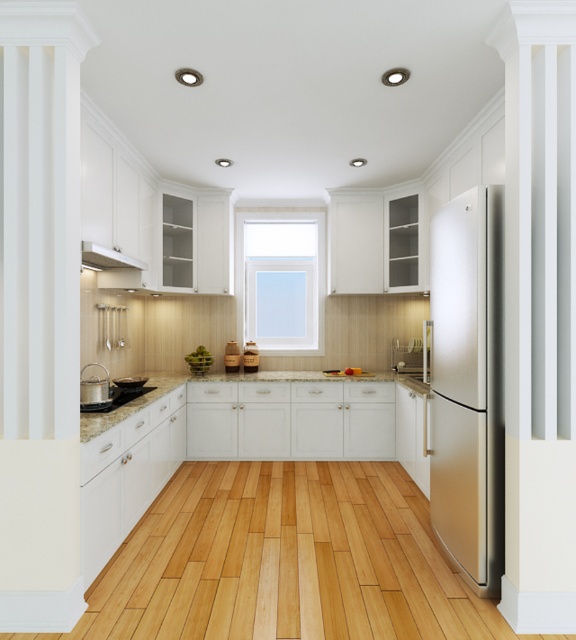
Question: Which object is closer to the camera taking this photo?

Choices:
 (A) satin stainless steel refrigerator at right
 (B) white matte exhaust hood at upper left
 (C) transparent glass window at center

Answer: (A)

Question: Does satin stainless steel refrigerator at right lie in front of transparent glass window at center?

Choices:
 (A) yes
 (B) no

Answer: (A)

Question: Which point is closer to the camera?

Choices:
 (A) granite countertop at center
 (B) transparent glass window at center
 (C) satin stainless steel refrigerator at right

Answer: (A)

Question: Can you confirm if transparent glass window at center is positioned to the left of brushed metal sink at lower left?

Choices:
 (A) no
 (B) yes

Answer: (A)

Question: In this image, where is transparent glass window at center located relative to granite countertop at center?

Choices:
 (A) above
 (B) below

Answer: (A)

Question: Among these objects, which one is farthest from the camera?

Choices:
 (A) transparent glass window at center
 (B) satin stainless steel refrigerator at right

Answer: (A)